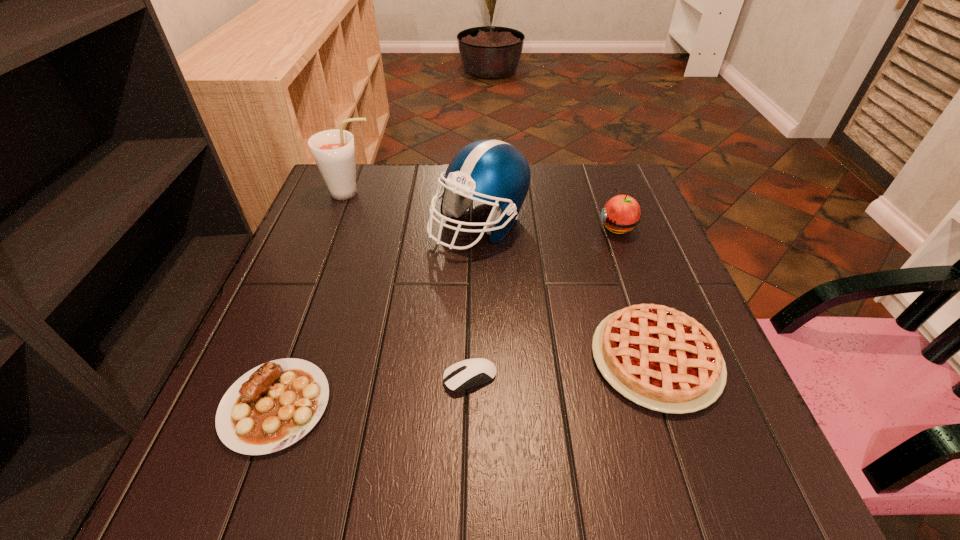
Where is `football helmet`? This screenshot has width=960, height=540. football helmet is located at coordinates (493, 172).

Locate an element on the screen. The height and width of the screenshot is (540, 960). root beer is located at coordinates (333, 150).

Image resolution: width=960 pixels, height=540 pixels. In order to click on apple in this screenshot , I will do `click(622, 213)`.

In order to click on the fourth tallest object in this screenshot , I will do `click(658, 357)`.

Identify the location of steak. coord(274,405).

This screenshot has width=960, height=540. Find the location of `mouse`. mouse is located at coordinates (483, 370).

At what (x,y) coordinates should I click in order to perform the action: click on vacant space located at the front of the football helmet with the faceguard. Please return your answer as a coordinate pair (x, y). Image resolution: width=960 pixels, height=540 pixels. Looking at the image, I should click on (479, 281).

Where is `blank space located on the drink side of the root beer`? The height and width of the screenshot is (540, 960). blank space located on the drink side of the root beer is located at coordinates (402, 193).

The width and height of the screenshot is (960, 540). I want to click on blank space located 0.160m on the left of the fourth shortest object, so click(x=536, y=227).

This screenshot has width=960, height=540. Identify the location of vacant space situated on the left of the third shortest object. (437, 359).